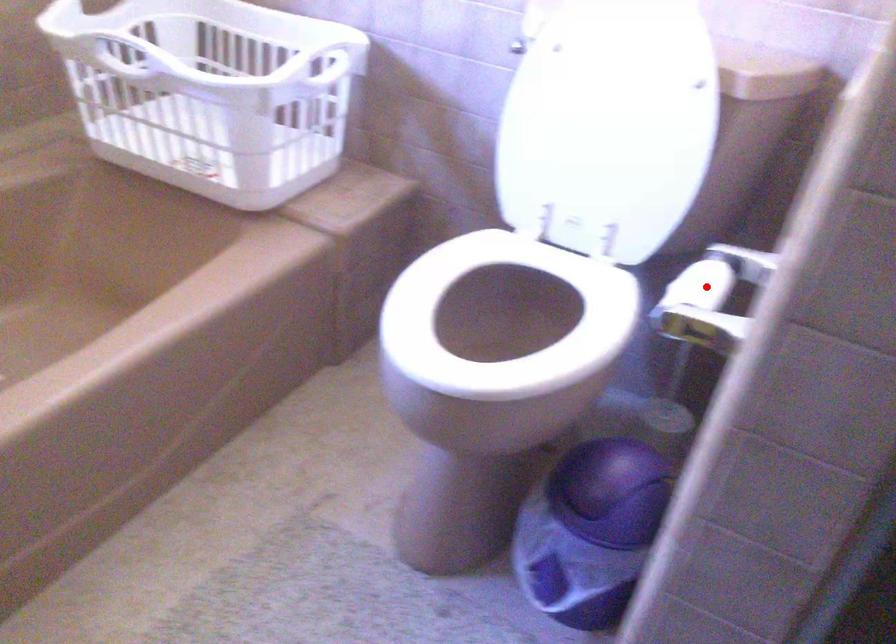
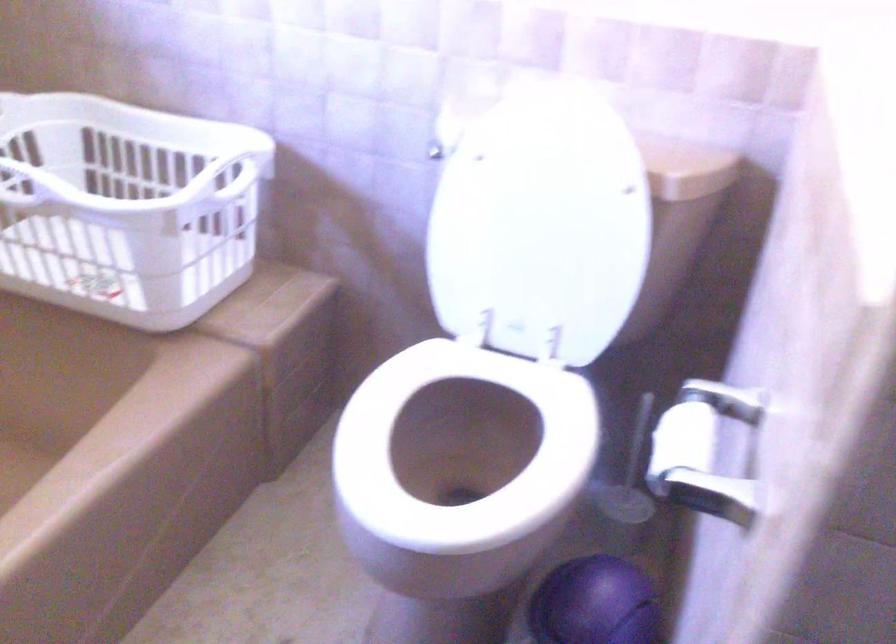
The point at the highlighted location is marked in the first image. Where is the corresponding point in the second image?

(698, 438)